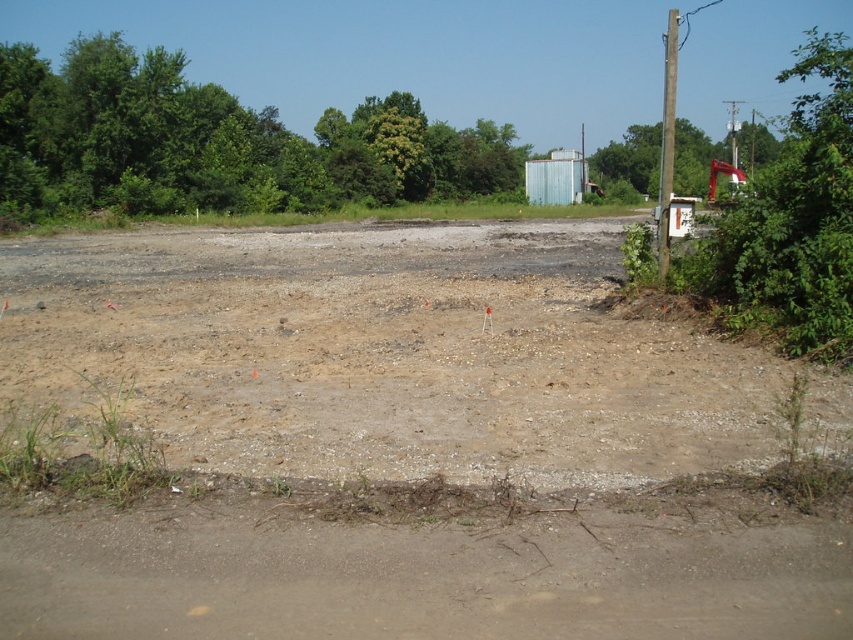
Question: Is green leafy tree at right bigger than green leafy tree at upper right?

Choices:
 (A) yes
 (B) no

Answer: (A)

Question: Which of these objects is positioned closest to the green leafy tree at upper left?

Choices:
 (A) metallic blue container at center-right
 (B) green leafy tree at right

Answer: (A)

Question: Can you confirm if brown gravel dirt field at center is wider than metallic blue container at center-right?

Choices:
 (A) yes
 (B) no

Answer: (A)

Question: In this image, where is dull brown dirt track at lower left located relative to green leafy tree at upper right?

Choices:
 (A) left
 (B) right

Answer: (A)

Question: Which object is farther from the camera taking this photo?

Choices:
 (A) metallic blue container at center-right
 (B) brown gravel dirt field at center
 (C) green leafy tree at upper left

Answer: (A)

Question: Among these points, which one is nearest to the camera?

Choices:
 (A) (764, 304)
 (B) (560, 156)
 (C) (527, 524)

Answer: (C)